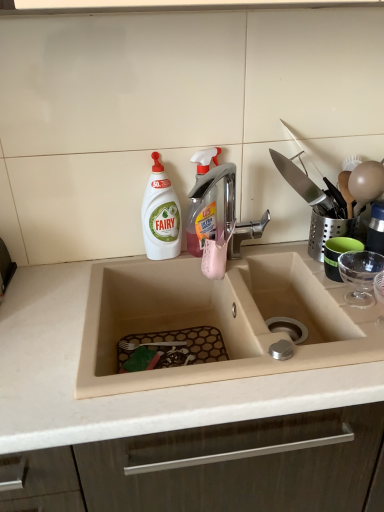
Question: Is translucent plastic spray bottle at upper center, acting as the 1th cleaning product starting from the right, wider or thinner than beige matte sink at center?

Choices:
 (A) thin
 (B) wide

Answer: (A)

Question: Considering the positions of translucent plastic spray bottle at upper center, marked as the 2th cleaning product in a left-to-right arrangement, and beige matte sink at center in the image, is translucent plastic spray bottle at upper center, marked as the 2th cleaning product in a left-to-right arrangement, taller or shorter than beige matte sink at center?

Choices:
 (A) short
 (B) tall

Answer: (B)

Question: Which of these objects is positioned closest to the translucent plastic spray bottle at upper center, acting as the 1th cleaning product starting from the right?

Choices:
 (A) white plastic bottle at upper left, positioned as the first cleaning product in left-to-right order
 (B) beige matte sink at center

Answer: (A)

Question: Considering the real-world distances, which object is farthest from the translucent plastic spray bottle at upper center, marked as the 2th cleaning product in a left-to-right arrangement?

Choices:
 (A) beige matte sink at center
 (B) white plastic bottle at upper left, positioned as the first cleaning product in left-to-right order

Answer: (A)